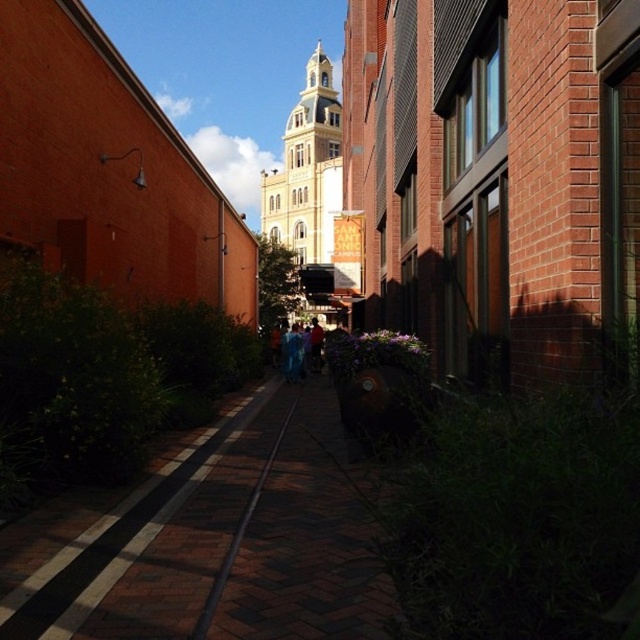
You are standing in the middle of the alley and want to walk towards the point at coordinates point (260,180). However, there is an obstacle at point (282,349). Can you safely reach your destination without passing through the obstacle?

Point (260,180) is behind point (282,349), so you cannot reach point (260,180) without passing through the obstacle at point (282,349).

You are a delivery person with a 1.2 meter wide cart. You need to navigate through the narrow alleyway shown in the image. The alley has a yellow matte building at center and a blue fabric at center. Can your cart pass through the space between these two objects?

The yellow matte building at center might be wider than blue fabric at center, so it is uncertain if the cart can pass. Check the actual width before proceeding.

You are standing at the entrance of the alleyway and notice two points marked in the image. Which point, point (218, 584) or point (300, 344), is closer to you?

Point (218, 584) is closer to the camera than point (300, 344).